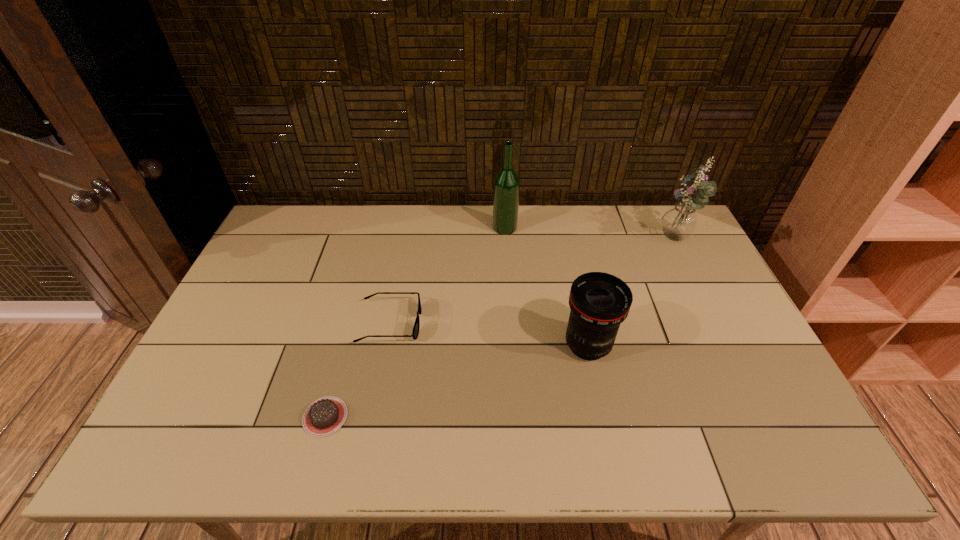
Where is `vacant space located on the front-facing side of the bouquet`? This screenshot has width=960, height=540. vacant space located on the front-facing side of the bouquet is located at coordinates (616, 242).

At what (x,y) coordinates should I click in order to perform the action: click on free space located on the back of the telephoto lens. Please return your answer as a coordinate pair (x, y). The height and width of the screenshot is (540, 960). Looking at the image, I should click on (576, 290).

In order to click on free space located on the front-facing side of the spectacles in this screenshot , I will do click(456, 322).

The image size is (960, 540). I want to click on vacant space positioned on the right of the nearest object, so click(x=515, y=417).

Locate an element on the screen. This screenshot has width=960, height=540. alcohol at the far edge is located at coordinates (506, 189).

You are a GUI agent. You are given a task and a screenshot of the screen. Output one action in this format:
    pyautogui.click(x=<x>, y=<y>)
    Task: Click on the bouquet located at the far edge
    
    Given the screenshot: What is the action you would take?
    pyautogui.click(x=679, y=222)

I want to click on object that is at the near edge, so click(x=326, y=415).

Where is `object that is positioned at the right edge`? object that is positioned at the right edge is located at coordinates (679, 222).

Where is `object that is at the far right corner`? This screenshot has width=960, height=540. object that is at the far right corner is located at coordinates (679, 222).

Locate an element on the screen. blank area at the far edge is located at coordinates (591, 207).